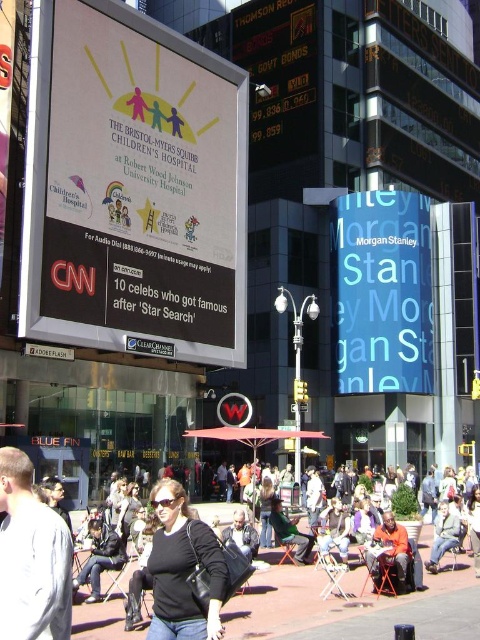
Who is shorter, dark gray jacket at lower left or black leather jacket at center?

Standing shorter between the two is dark gray jacket at lower left.

Between point (35, 611) and point (148, 637), which one is positioned in front?

Point (35, 611) is in front.

The height and width of the screenshot is (640, 480). What do you see at coordinates (32, 557) in the screenshot?
I see `dark gray jacket at lower left` at bounding box center [32, 557].

The width and height of the screenshot is (480, 640). What are the coordinates of `dark gray jacket at lower left` in the screenshot? It's located at (32, 557).

Which is in front, point (361, 273) or point (120, 561)?

Positioned in front is point (120, 561).

Is blue glossy morgan stanley sign at upper right bigger than dark blue jeans at lower left?

Correct, blue glossy morgan stanley sign at upper right is larger in size than dark blue jeans at lower left.

The width and height of the screenshot is (480, 640). What do you see at coordinates (383, 292) in the screenshot?
I see `blue glossy morgan stanley sign at upper right` at bounding box center [383, 292].

Identify the location of blue glossy morgan stanley sign at upper right. The height and width of the screenshot is (640, 480). (383, 292).

Does point (224, 593) come in front of point (383, 564)?

Yes, it is.

Is black leather jacket at center shorter than orange fabric chair at lower right?

In fact, black leather jacket at center may be taller than orange fabric chair at lower right.

Which is behind, point (162, 512) or point (395, 561)?

Point (395, 561)

The image size is (480, 640). Find the location of `black leather jacket at center`. black leather jacket at center is located at coordinates (182, 568).